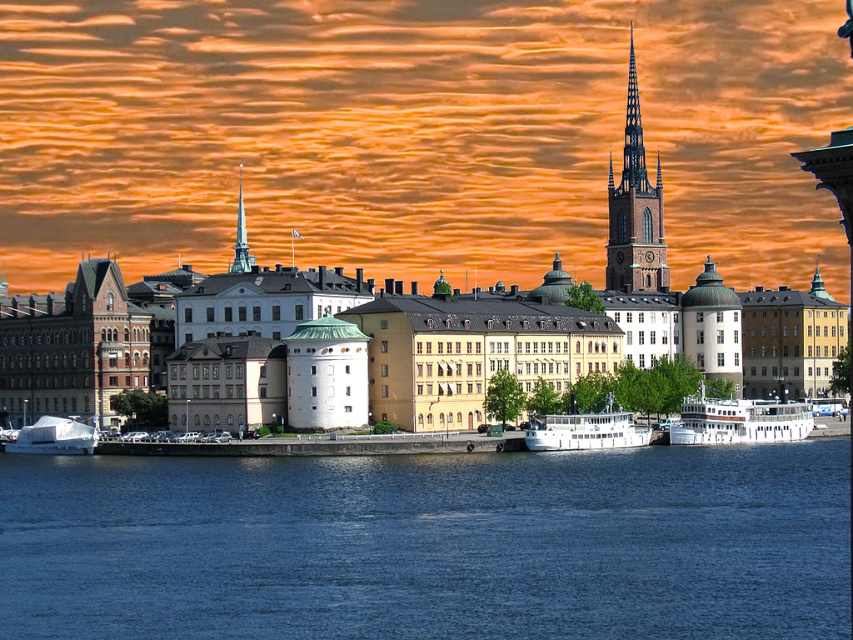
Question: Can you confirm if white glossy boat at lower right is bigger than smooth white spire at center?

Choices:
 (A) no
 (B) yes

Answer: (A)

Question: Considering the real-world distances, which object is farthest from the white matte boat at center?

Choices:
 (A) white glossy boat at lower right
 (B) smooth white spire at center

Answer: (B)

Question: Which object is positioned closest to the white matte boat at lower left?

Choices:
 (A) smooth white spire at center
 (B) white glossy boat at lower right
 (C) white matte boat at center

Answer: (A)

Question: Considering the relative positions of blue water at center and brown stone spire at upper right in the image provided, where is blue water at center located with respect to brown stone spire at upper right?

Choices:
 (A) left
 (B) right

Answer: (A)

Question: Considering the relative positions of blue water at center and white matte boat at center in the image provided, where is blue water at center located with respect to white matte boat at center?

Choices:
 (A) above
 (B) below

Answer: (B)

Question: Which object is the closest to the smooth white spire at center?

Choices:
 (A) white glossy boat at lower right
 (B) brown stone spire at upper right
 (C) white matte boat at lower left
 (D) white matte boat at center

Answer: (C)